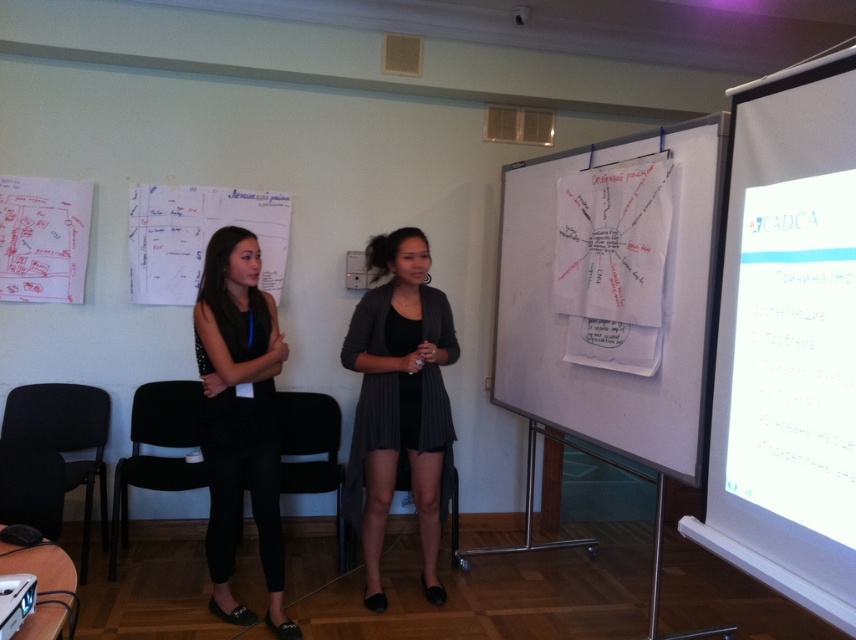
You are an event planner organizing a photoshoot in this presentation room. You need to decide whether to place a 1.8m tall tripod between the black matte dress at center and the black fabric chair at center. Can the tripod fit vertically between them without touching either object?

The black matte dress at center is taller than the black fabric chair at center. Since the tripod is 1.8m tall, it can be placed vertically between them as long as there is enough horizontal space. However, the exact vertical clearance depends on the height difference between the two objects. Without specific measurements, it is uncertain if the tripod will fit without touching either object.

You are an attendee at the presentation and need to take a photo of the white glossy projection screen at right. The room has a rule that photos must be taken from the front of the screen. Based on the screen location, where should you position yourself to ensure you are in front of it?

To be in front of the white glossy projection screen at right, you should position yourself facing the screen from the side where the presenter is standing, as the screen is located at point (786, 340) which places it on the right side of the room from the presenter perspective. This ensures you are capturing it from the front as required.